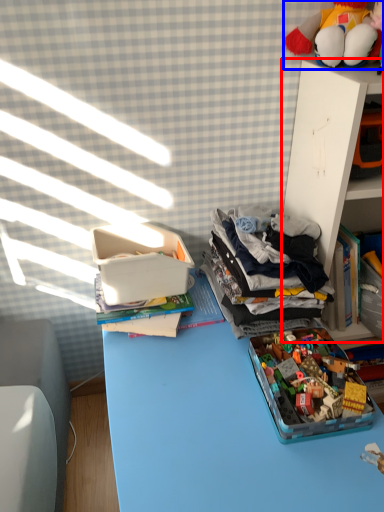
Question: Which point is closer to the camera, shelf (highlighted by a red box) or toy (highlighted by a blue box)?

Choices:
 (A) shelf
 (B) toy

Answer: (B)